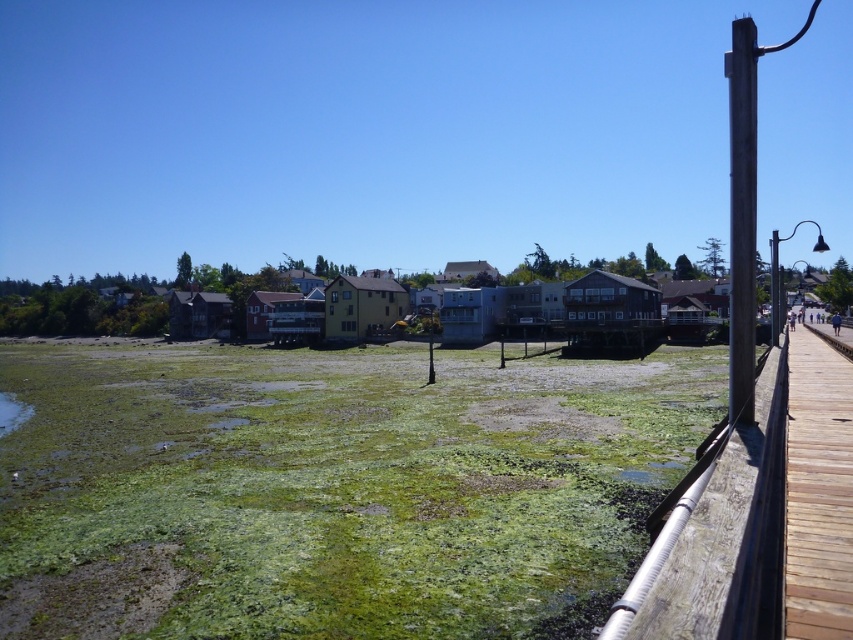
Question: Is wooden dock at right behind brown wooden post at right?

Choices:
 (A) no
 (B) yes

Answer: (A)

Question: Among these points, which one is farthest from the camera?

Choices:
 (A) (796, 428)
 (B) (86, 442)
 (C) (648, 586)

Answer: (B)

Question: Which point is closer to the camera?

Choices:
 (A) coord(83,509)
 (B) coord(750,100)

Answer: (B)

Question: Is green mossy grass at lower left to the right of brown wooden post at right from the viewer's perspective?

Choices:
 (A) yes
 (B) no

Answer: (B)

Question: Among these objects, which one is farthest from the camera?

Choices:
 (A) brown wooden post at right
 (B) wooden at right
 (C) green mossy grass at lower left
 (D) wooden dock at right

Answer: (C)

Question: Does green mossy grass at lower left appear on the left side of wooden dock at right?

Choices:
 (A) no
 (B) yes

Answer: (B)